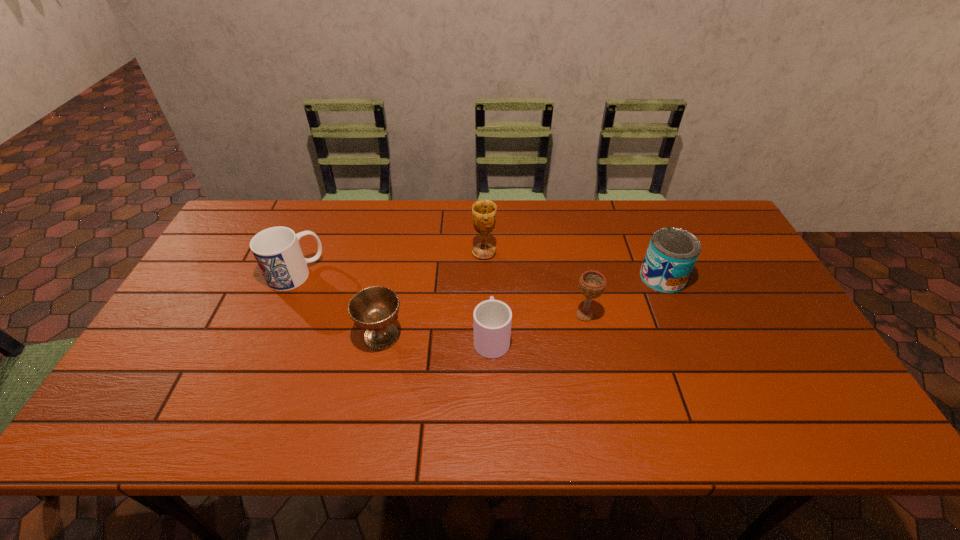
This screenshot has height=540, width=960. Identify the location of free space located on the back of the can. (648, 244).

Locate an element on the screen. vacant space located on the left of the leftmost chalice is located at coordinates (304, 336).

Identify the location of free space located 0.100m with the handle on the side of the cup. (491, 290).

Where is `vacant space situated with the handle on the side of the cup`? The width and height of the screenshot is (960, 540). vacant space situated with the handle on the side of the cup is located at coordinates (491, 293).

This screenshot has height=540, width=960. I want to click on free space located 0.080m with the handle on the side of the cup, so click(x=491, y=295).

Locate an element on the screen. The width and height of the screenshot is (960, 540). object at the far edge is located at coordinates 483,211.

Where is `vacant region at the far edge of the desktop`? vacant region at the far edge of the desktop is located at coordinates (614, 229).

Identify the location of vacant space at the near edge. (300, 411).

The height and width of the screenshot is (540, 960). In order to click on vacant space at the left edge of the desktop in this screenshot , I will do `click(242, 284)`.

In the image, there is a desktop. Identify the location of blank space at the right edge. (756, 279).